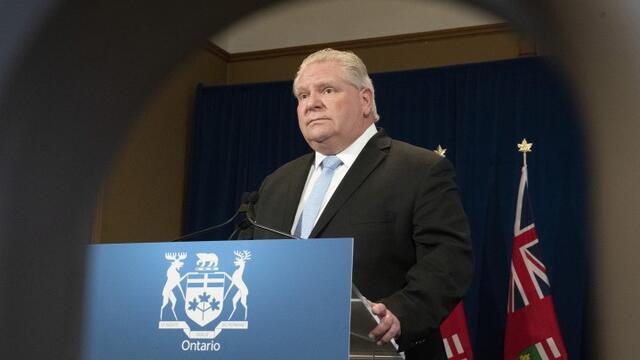
Image resolution: width=640 pixels, height=360 pixels. Find the location of `table`. table is located at coordinates (301, 282).